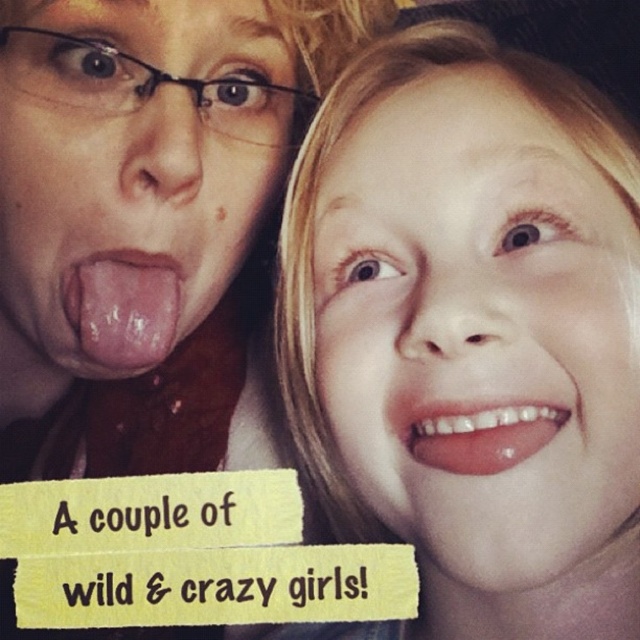
You are a photographer trying to capture a candid shot of two people in the scene. You notice the pink flesh at center and the pink flesh tongue at center. Which one is taller?

The pink flesh at center is much taller than the pink flesh tongue at center according to the description.

You are a photographer trying to focus on the tongue of the person on the left. The camera has a focus point at coordinate point (122,308). Is this focus point on the tongue?

Yes, the point (122,308) is on the pink flesh tongue at center, so the focus point is correctly placed on the tongue.